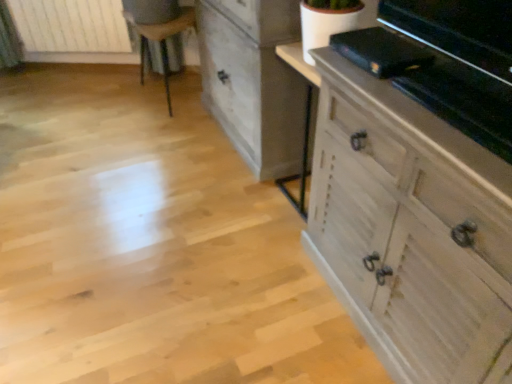
Question: Considering the relative sizes of white wood chest of drawers at right, the second chest of drawers positioned from the back, and white wooden radiator at upper left in the image provided, is white wood chest of drawers at right, the second chest of drawers positioned from the back, smaller than white wooden radiator at upper left?

Choices:
 (A) no
 (B) yes

Answer: (A)

Question: Is white wooden radiator at upper left located within white wood chest of drawers at right, the second chest of drawers positioned from the back?

Choices:
 (A) no
 (B) yes

Answer: (A)

Question: Can you confirm if white wood chest of drawers at right, which ranks as the 1th chest of drawers in front-to-back order, is shorter than white wooden radiator at upper left?

Choices:
 (A) yes
 (B) no

Answer: (B)

Question: Is white wooden radiator at upper left at the back of white wood chest of drawers at right, the second chest of drawers positioned from the back?

Choices:
 (A) yes
 (B) no

Answer: (B)

Question: Does white wood chest of drawers at right, which ranks as the 1th chest of drawers in front-to-back order, have a larger size compared to white wooden radiator at upper left?

Choices:
 (A) no
 (B) yes

Answer: (B)

Question: Considering the positions of wooden chair at upper left and white wooden radiator at upper left in the image, is wooden chair at upper left taller or shorter than white wooden radiator at upper left?

Choices:
 (A) short
 (B) tall

Answer: (B)

Question: Is point click(187, 13) closer or farther from the camera than point click(40, 39)?

Choices:
 (A) closer
 (B) farther

Answer: (A)

Question: Looking at the image, does wooden chair at upper left seem bigger or smaller compared to white wooden radiator at upper left?

Choices:
 (A) small
 (B) big

Answer: (B)

Question: Considering the positions of wooden chair at upper left and white wooden radiator at upper left in the image, is wooden chair at upper left wider or thinner than white wooden radiator at upper left?

Choices:
 (A) thin
 (B) wide

Answer: (B)

Question: Which is correct: white wood chest of drawers at right, which ranks as the 1th chest of drawers in front-to-back order, is inside white wooden radiator at upper left, or outside of it?

Choices:
 (A) inside
 (B) outside

Answer: (B)

Question: Considering their positions, is white wood chest of drawers at right, which ranks as the 1th chest of drawers in front-to-back order, located in front of or behind white wooden radiator at upper left?

Choices:
 (A) front
 (B) behind

Answer: (A)

Question: Considering the relative positions of white wood chest of drawers at right, which ranks as the 1th chest of drawers in front-to-back order, and white wooden radiator at upper left in the image provided, is white wood chest of drawers at right, which ranks as the 1th chest of drawers in front-to-back order, to the left or to the right of white wooden radiator at upper left?

Choices:
 (A) right
 (B) left

Answer: (A)

Question: Is point (318, 142) closer or farther from the camera than point (33, 6)?

Choices:
 (A) closer
 (B) farther

Answer: (A)

Question: From the image's perspective, is white wooden radiator at upper left above or below distressed white chest of drawers at center, which is the 1th chest of drawers in back-to-front order?

Choices:
 (A) below
 (B) above

Answer: (B)

Question: Considering the positions of white wooden radiator at upper left and distressed white chest of drawers at center, which is counted as the second chest of drawers, starting from the front, in the image, is white wooden radiator at upper left taller or shorter than distressed white chest of drawers at center, which is counted as the second chest of drawers, starting from the front,?

Choices:
 (A) tall
 (B) short

Answer: (B)